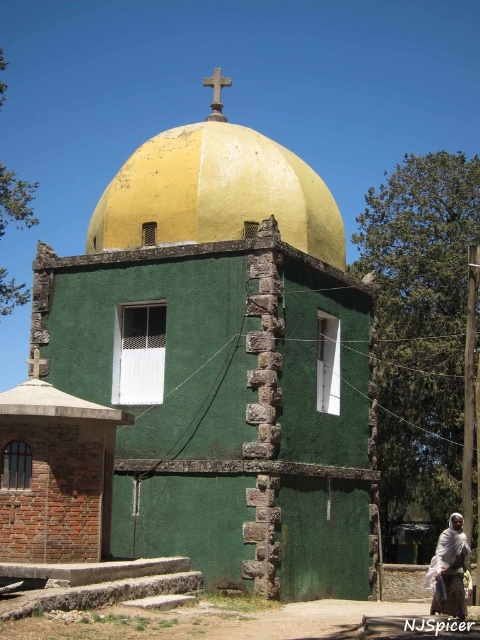
Question: Which point is closer to the camera taking this photo?

Choices:
 (A) (115, 188)
 (B) (214, 81)
 (C) (453, 538)

Answer: (C)

Question: Observing the image, what is the correct spatial positioning of white textured cloth at lower right in reference to smooth stone cross at upper center?

Choices:
 (A) right
 (B) left

Answer: (A)

Question: Can you confirm if white textured cloth at lower right is positioned to the left of smooth stone cross at upper center?

Choices:
 (A) no
 (B) yes

Answer: (A)

Question: Which object appears farthest from the camera in this image?

Choices:
 (A) green stone church at center
 (B) smooth stone cross at upper center

Answer: (B)

Question: Does yellow matte dome at center have a greater width compared to white textured cloth at lower right?

Choices:
 (A) no
 (B) yes

Answer: (B)

Question: Which object is positioned farthest from the yellow matte dome at center?

Choices:
 (A) green stone church at center
 (B) white textured cloth at lower right
 (C) smooth stone cross at upper center

Answer: (B)